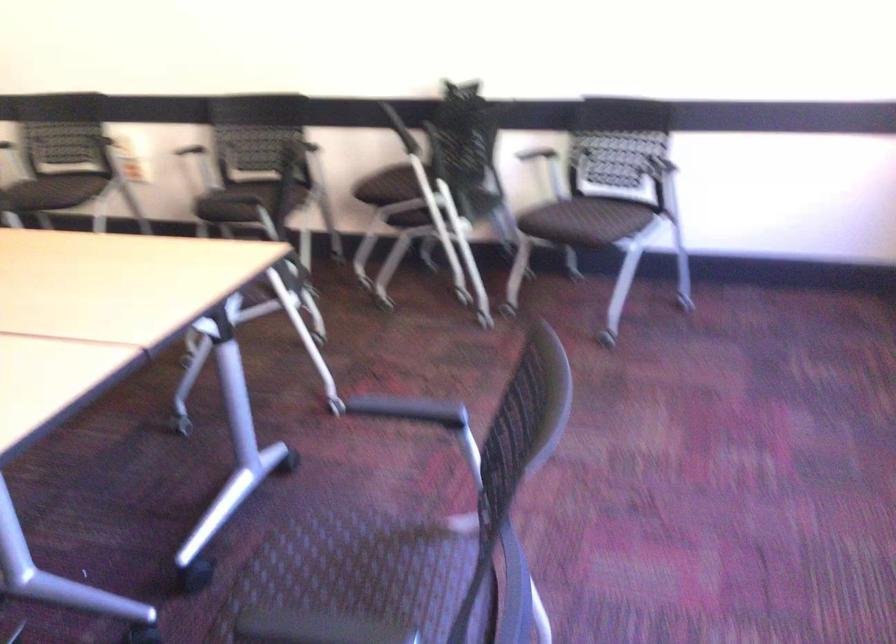
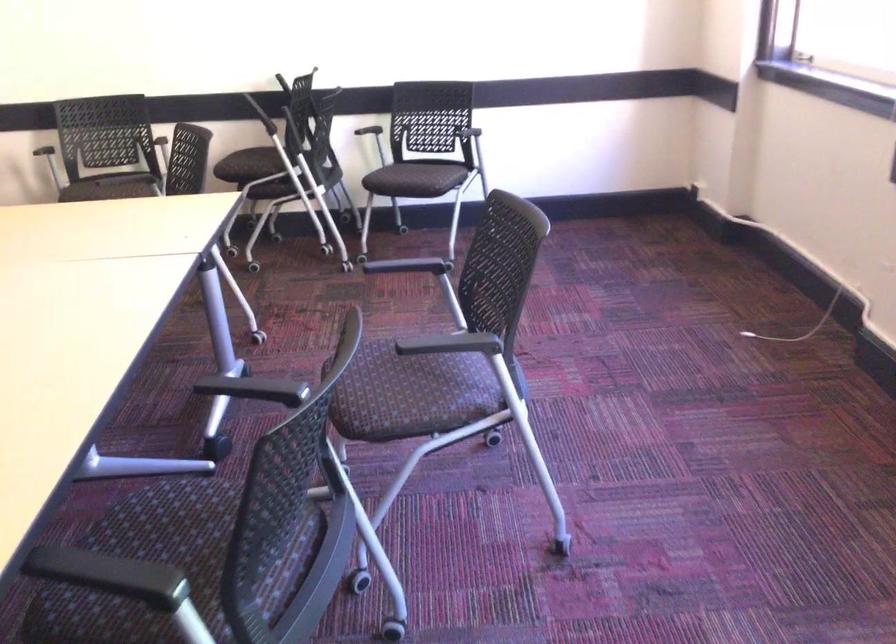
In the second image, find the point that corresponds to (x=435, y=408) in the first image.

(414, 268)